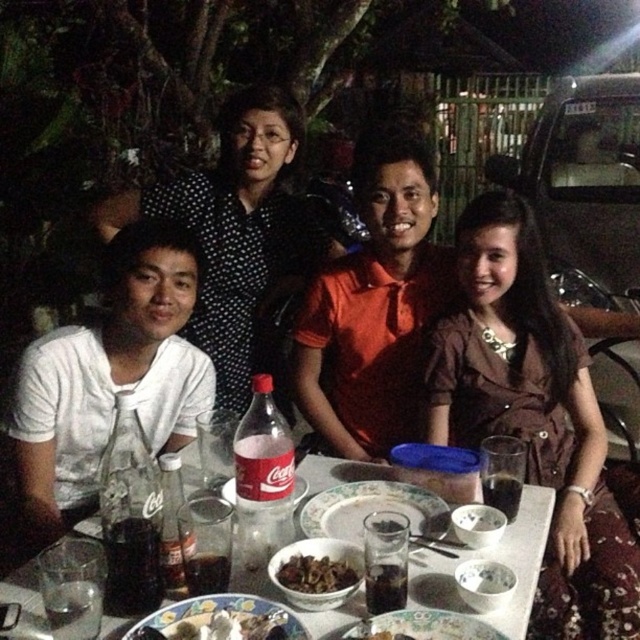
Question: Is white matte rice bowl at center to the right of translucent glass plate at center from the viewer's perspective?

Choices:
 (A) yes
 (B) no

Answer: (A)

Question: Considering the relative positions of matte plastic platter at center and matte ceramic platter at center in the image provided, where is matte plastic platter at center located with respect to matte ceramic platter at center?

Choices:
 (A) right
 (B) left

Answer: (A)

Question: Among these objects, which one is nearest to the camera?

Choices:
 (A) translucent glass table at center
 (B) white matte bowl at center

Answer: (A)

Question: Based on their relative distances, which object is nearer to the black dotted shirt at upper center?

Choices:
 (A) white matte bowl at center
 (B) translucent glass table at center

Answer: (B)

Question: Is matte plastic platter at center smaller than white matte rice bowl at center?

Choices:
 (A) yes
 (B) no

Answer: (B)

Question: Based on their relative distances, which object is nearer to the translucent glass plate at center?

Choices:
 (A) brown satin dress at center
 (B) porcelain bowl at lower center
 (C) white matte rice bowl at center
 (D) matte plastic platter at center

Answer: (D)